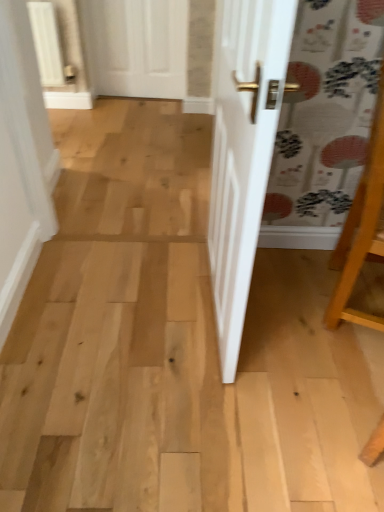
Question: Does wooden easel at right lie in front of white matte door at upper center?

Choices:
 (A) no
 (B) yes

Answer: (B)

Question: Considering the relative sizes of wooden easel at right and white matte door at upper center in the image provided, is wooden easel at right taller than white matte door at upper center?

Choices:
 (A) yes
 (B) no

Answer: (A)

Question: Considering the relative sizes of wooden easel at right and white matte door at upper center in the image provided, is wooden easel at right wider than white matte door at upper center?

Choices:
 (A) yes
 (B) no

Answer: (A)

Question: From the image's perspective, is wooden easel at right under white matte door at upper center?

Choices:
 (A) yes
 (B) no

Answer: (A)

Question: Considering the relative positions of wooden easel at right and white matte door at upper center in the image provided, is wooden easel at right to the right of white matte door at upper center from the viewer's perspective?

Choices:
 (A) yes
 (B) no

Answer: (A)

Question: From a real-world perspective, is wooden easel at right physically below white matte door at upper center?

Choices:
 (A) yes
 (B) no

Answer: (B)

Question: Does white matte door at upper center have a lesser height compared to wooden easel at right?

Choices:
 (A) no
 (B) yes

Answer: (B)

Question: Is white matte door at upper center placed right next to wooden easel at right?

Choices:
 (A) no
 (B) yes

Answer: (A)

Question: Can you confirm if white matte door at upper center is taller than wooden easel at right?

Choices:
 (A) yes
 (B) no

Answer: (B)

Question: From a real-world perspective, is white matte door at upper center positioned under wooden easel at right based on gravity?

Choices:
 (A) no
 (B) yes

Answer: (B)

Question: Is white matte door at upper center looking in the opposite direction of wooden easel at right?

Choices:
 (A) yes
 (B) no

Answer: (B)

Question: Is white matte door at upper center in front of wooden easel at right?

Choices:
 (A) yes
 (B) no

Answer: (B)

Question: Which is correct: white matte door at upper center is inside wooden easel at right, or outside of it?

Choices:
 (A) outside
 (B) inside

Answer: (A)